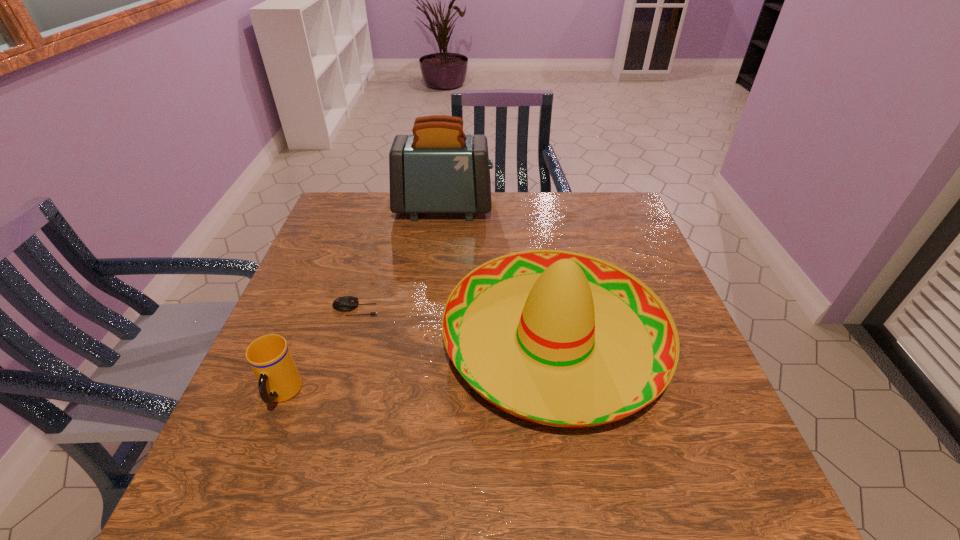
Locate an element on the screen. The width and height of the screenshot is (960, 540). vacant point that satisfies the following two spatial constraints: 1. on the front-facing side of the toaster; 2. on the front side of the shortest object is located at coordinates (432, 308).